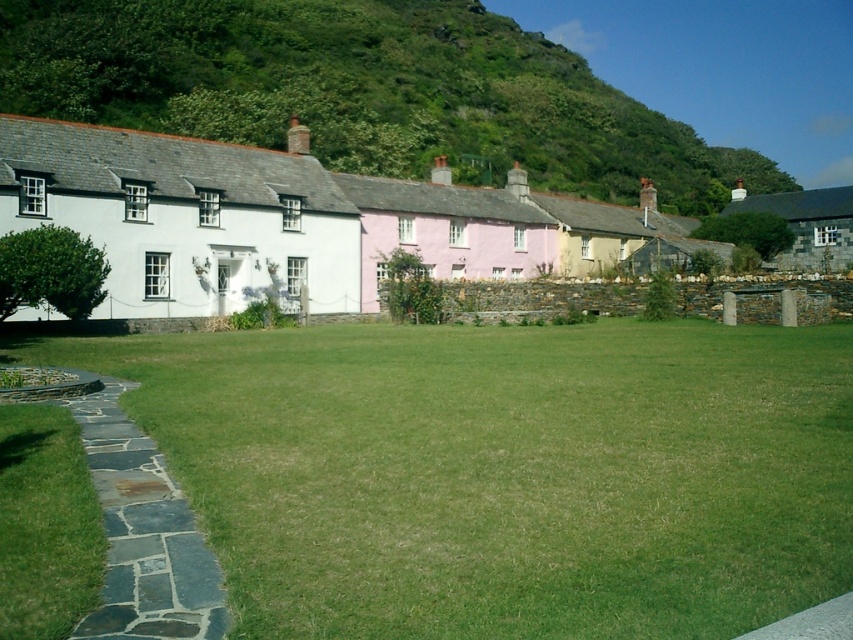
Who is higher up, green leafy hillside at upper center or stone cottage at right?

green leafy hillside at upper center

Does green leafy hillside at upper center appear on the right side of stone cottage at right?

Incorrect, green leafy hillside at upper center is not on the right side of stone cottage at right.

Is point (28, 44) in front of point (824, 227)?

That is True.

You are a GUI agent. You are given a task and a screenshot of the screen. Output one action in this format:
    pyautogui.click(x=<x>, y=<y>)
    Task: Click on the green leafy hillside at upper center
    The image size is (853, 640).
    Given the screenshot: What is the action you would take?
    pyautogui.click(x=363, y=90)

Between green grass at center and green leafy hillside at upper center, which one appears on the left side from the viewer's perspective?

green grass at center is more to the left.

Between point (422, 579) and point (448, 61), which one is positioned behind?

The point (448, 61) is behind.

This screenshot has width=853, height=640. I want to click on green grass at center, so click(502, 472).

Is green leafy hillside at upper center to the left of dark gray stone path at lower left from the viewer's perspective?

No, green leafy hillside at upper center is not to the left of dark gray stone path at lower left.

Does green leafy hillside at upper center have a greater width compared to dark gray stone path at lower left?

Yes.

Which is behind, point (561, 77) or point (97, 392)?

Point (561, 77)

Locate an element on the screen. green leafy hillside at upper center is located at coordinates (363, 90).